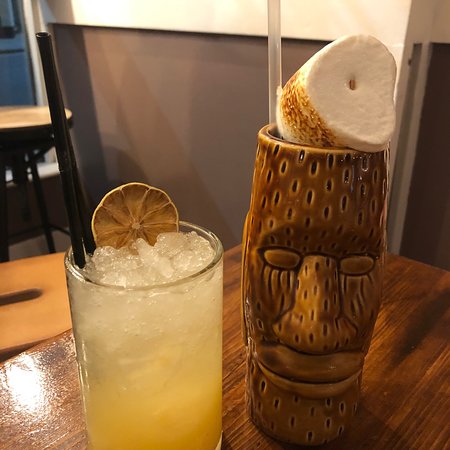
Locate an element on the screen. The image size is (450, 450). tiki glass is located at coordinates (343, 310).